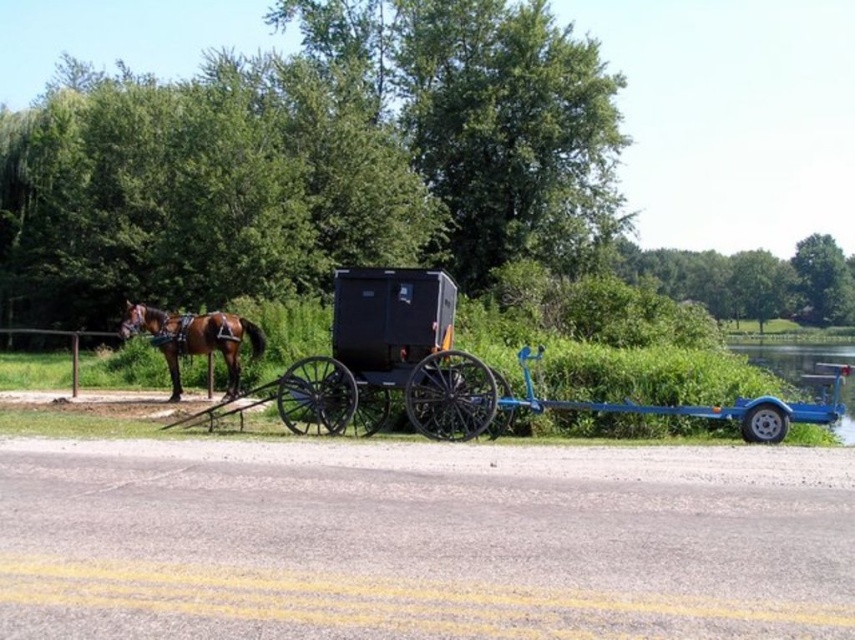
You are standing at the origin point of the image. You see a point marked at coordinates (x=453, y=372). What object is located at that point?

The point at coordinates (x=453, y=372) corresponds to the black wooden horse cart at center.

You are a tourist standing at the roadside and see the black wooden horse cart at center and the brown glossy horse at left. Which object is closer to you?

The black wooden horse cart at center is closer to you because it is in front of the brown glossy horse at left.

You are a delivery person who needs to load a large package onto the black wooden horse cart at center. The package is taller than the brown glossy horse at left. Can the package fit on the cart?

The black wooden horse cart at center is much taller than the brown glossy horse at left. Since the package is taller than the horse, it might still fit on the cart as the cart itself is taller than the horse.